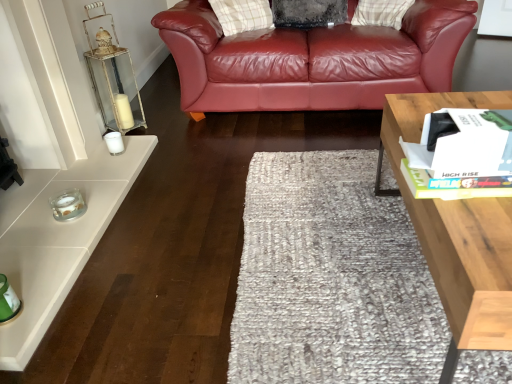
What is the approximate width of light wood/texture coffee table at right?

light wood/texture coffee table at right is 22.56 inches in width.

Where is `white glass candle at left, which is the second candle holder in bottom-to-top order`? white glass candle at left, which is the second candle holder in bottom-to-top order is located at coordinates (114, 142).

Is clear glass candle at lower left, acting as the second candle holder starting from the top, inside the boundaries of white glass candle at left, the first candle holder from the back, or outside?

clear glass candle at lower left, acting as the second candle holder starting from the top, is spatially situated outside white glass candle at left, the first candle holder from the back.

Is clear glass candle at lower left, which is counted as the 1th candle holder, starting from the bottom, thinner than white glass candle at left, which is the second candle holder in bottom-to-top order?

No.

Consider the image. From their relative heights in the image, would you say clear glass candle at lower left, acting as the first candle holder starting from the front, is taller or shorter than white glass candle at left, the first candle holder from the back?

clear glass candle at lower left, acting as the first candle holder starting from the front, is shorter than white glass candle at left, the first candle holder from the back.

Find the location of a particular element. The width and height of the screenshot is (512, 384). candle holder located in front of the white glass candle at left, which is the second candle holder in bottom-to-top order is located at coordinates (68, 205).

Consider the image. From their relative heights in the image, would you say light wood/texture coffee table at right is taller or shorter than white glass candle at left, the first candle holder from the back?

Considering their sizes, light wood/texture coffee table at right has more height than white glass candle at left, the first candle holder from the back.

Considering the relative sizes of light wood/texture coffee table at right and white glass candle at left, marked as the 2th candle holder in a front-to-back arrangement, in the image provided, is light wood/texture coffee table at right wider than white glass candle at left, marked as the 2th candle holder in a front-to-back arrangement,?

Indeed, light wood/texture coffee table at right has a greater width compared to white glass candle at left, marked as the 2th candle holder in a front-to-back arrangement.

Based on the photo, is light wood/texture coffee table at right positioned with its back to white glass candle at left, arranged as the first candle holder when viewed from the top?

No, white glass candle at left, arranged as the first candle holder when viewed from the top, is not at the back of light wood/texture coffee table at right.

What's the angular difference between light wood/texture coffee table at right and white glass candle at left, which is the second candle holder in bottom-to-top order,'s facing directions?

The facing directions of light wood/texture coffee table at right and white glass candle at left, which is the second candle holder in bottom-to-top order, are 177 degrees apart.

Can you confirm if clear glass candle at lower left, acting as the second candle holder starting from the top, is bigger than light wood/texture coffee table at right?

No.

Would you say light wood/texture coffee table at right is part of clear glass candle at lower left, acting as the first candle holder starting from the front,'s contents?

No, light wood/texture coffee table at right is located outside of clear glass candle at lower left, acting as the first candle holder starting from the front.

From the image's perspective, is clear glass candle at lower left, which is counted as the second candle holder, starting from the back, located above light wood/texture coffee table at right?

Yes, from the image's perspective, clear glass candle at lower left, which is counted as the second candle holder, starting from the back, is on top of light wood/texture coffee table at right.

Between clear glass candle at lower left, acting as the second candle holder starting from the top, and light wood/texture coffee table at right, which one has larger width?

light wood/texture coffee table at right is wider.

Is light wood/texture coffee table at right positioned before clear glass candle at lower left, acting as the second candle holder starting from the top?

Yes, it is.

Is light wood/texture coffee table at right taller or shorter than clear glass candle at lower left, which is counted as the 1th candle holder, starting from the bottom?

In the image, light wood/texture coffee table at right appears to be taller than clear glass candle at lower left, which is counted as the 1th candle holder, starting from the bottom.

From the image's perspective, would you say light wood/texture coffee table at right is positioned over clear glass candle at lower left, acting as the second candle holder starting from the top?

No, from the image's perspective, light wood/texture coffee table at right is not over clear glass candle at lower left, acting as the second candle holder starting from the top.

Does point (384, 141) come farther from viewer compared to point (65, 220)?

No, it is not.

Does white glass candle at left, marked as the 2th candle holder in a front-to-back arrangement, have a lesser height compared to light wood/texture coffee table at right?

Yes.

Visually, is white glass candle at left, the first candle holder from the back, positioned to the left or to the right of light wood/texture coffee table at right?

white glass candle at left, the first candle holder from the back, is to the left of light wood/texture coffee table at right.

How many degrees apart are the facing directions of white glass candle at left, arranged as the first candle holder when viewed from the top, and light wood/texture coffee table at right?

The facing directions of white glass candle at left, arranged as the first candle holder when viewed from the top, and light wood/texture coffee table at right are 177 degrees apart.

Which of these two, white glass candle at left, which is the second candle holder in bottom-to-top order, or clear glass candle at lower left, which is counted as the 1th candle holder, starting from the bottom, is wider?

clear glass candle at lower left, which is counted as the 1th candle holder, starting from the bottom.

Between white glass candle at left, the first candle holder from the back, and clear glass candle at lower left, which is counted as the 1th candle holder, starting from the bottom, which one appears on the right side from the viewer's perspective?

Positioned to the right is white glass candle at left, the first candle holder from the back.

How much distance is there between white glass candle at left, arranged as the first candle holder when viewed from the top, and clear glass candle at lower left, acting as the second candle holder starting from the top?

white glass candle at left, arranged as the first candle holder when viewed from the top, is 18.25 inches away from clear glass candle at lower left, acting as the second candle holder starting from the top.

Is point (110, 135) behind point (51, 205)?

Yes, it is behind point (51, 205).

I want to click on candle holder above the clear glass candle at lower left, acting as the first candle holder starting from the front (from a real-world perspective), so click(114, 142).

Identify the location of the 1st candle holder counting from the left side of the light wood/texture coffee table at right. (114, 142).

Considering their positions, is light wood/texture coffee table at right positioned closer to white glass candle at left, marked as the 2th candle holder in a front-to-back arrangement, than clear glass candle at lower left, acting as the second candle holder starting from the top?

Among the two, clear glass candle at lower left, acting as the second candle holder starting from the top, is located nearer to white glass candle at left, marked as the 2th candle holder in a front-to-back arrangement.

When comparing their distances from clear glass candle at lower left, which is counted as the 1th candle holder, starting from the bottom, does light wood/texture coffee table at right or white glass candle at left, which is the second candle holder in bottom-to-top order, seem closer?

white glass candle at left, which is the second candle holder in bottom-to-top order, is positioned closer to the anchor clear glass candle at lower left, which is counted as the 1th candle holder, starting from the bottom.

Which object lies further to the anchor point white glass candle at left, arranged as the first candle holder when viewed from the top, clear glass candle at lower left, which is counted as the 1th candle holder, starting from the bottom, or light wood/texture coffee table at right?

light wood/texture coffee table at right lies further to white glass candle at left, arranged as the first candle holder when viewed from the top, than the other object.

Based on their spatial positions, is white glass candle at left, arranged as the first candle holder when viewed from the top, or light wood/texture coffee table at right closer to clear glass candle at lower left, which is counted as the second candle holder, starting from the back?

The object closer to clear glass candle at lower left, which is counted as the second candle holder, starting from the back, is white glass candle at left, arranged as the first candle holder when viewed from the top.

Looking at the image, which one is located further to light wood/texture coffee table at right, white glass candle at left, which is the second candle holder in bottom-to-top order, or clear glass candle at lower left, which is counted as the second candle holder, starting from the back?

Based on the image, white glass candle at left, which is the second candle holder in bottom-to-top order, appears to be further to light wood/texture coffee table at right.

Based on the photo, looking at the image, which one is located further to light wood/texture coffee table at right, clear glass candle at lower left, acting as the first candle holder starting from the front, or white glass candle at left, which is the second candle holder in bottom-to-top order?

white glass candle at left, which is the second candle holder in bottom-to-top order, is further to light wood/texture coffee table at right.

The height and width of the screenshot is (384, 512). I want to click on candle holder located between clear glass candle at lower left, which is counted as the second candle holder, starting from the back, and light wood/texture coffee table at right in the left-right direction, so click(114, 142).